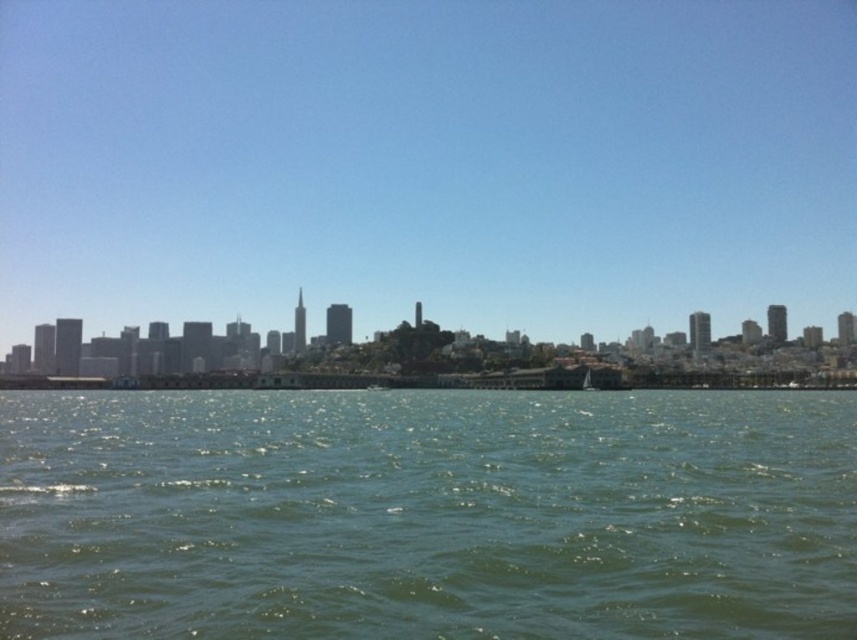
Question: Which object appears closest to the camera in this image?

Choices:
 (A) transparent glass skyline at center
 (B) green liquid water at lower center
 (C) white matte sailboat at center

Answer: (B)

Question: Can you confirm if transparent glass skyline at center is wider than green liquid water at lower center?

Choices:
 (A) yes
 (B) no

Answer: (A)

Question: Which point is closer to the camera?

Choices:
 (A) (75, 456)
 (B) (586, 45)

Answer: (A)

Question: Which is farther from the green liquid water at lower center?

Choices:
 (A) transparent glass skyline at center
 (B) white matte sailboat at center

Answer: (A)

Question: Can you confirm if transparent glass skyline at center is thinner than green liquid water at lower center?

Choices:
 (A) no
 (B) yes

Answer: (A)

Question: Considering the relative positions of transparent glass skyline at center and white matte sailboat at center in the image provided, where is transparent glass skyline at center located with respect to white matte sailboat at center?

Choices:
 (A) left
 (B) right

Answer: (A)